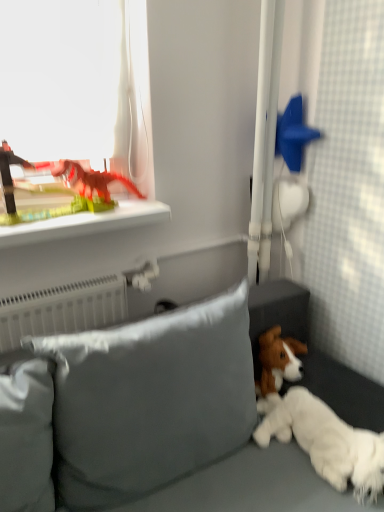
You are a GUI agent. You are given a task and a screenshot of the screen. Output one action in this format:
    pyautogui.click(x=<x>, y=<y>)
    Task: Click on the vacant space underneath white fluffy dog at lower right (from a real-world perspective)
    
    Given the screenshot: What is the action you would take?
    pyautogui.click(x=309, y=458)